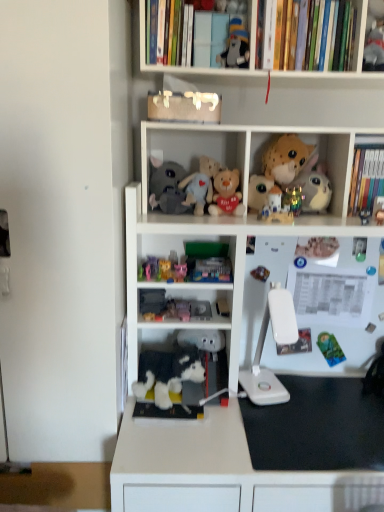
At what (x,y) coordinates should I click in order to perform the action: click on vacant space to the right of white plastic lamp at lower right. Please return your answer as a coordinate pair (x, y). Looking at the image, I should click on (307, 386).